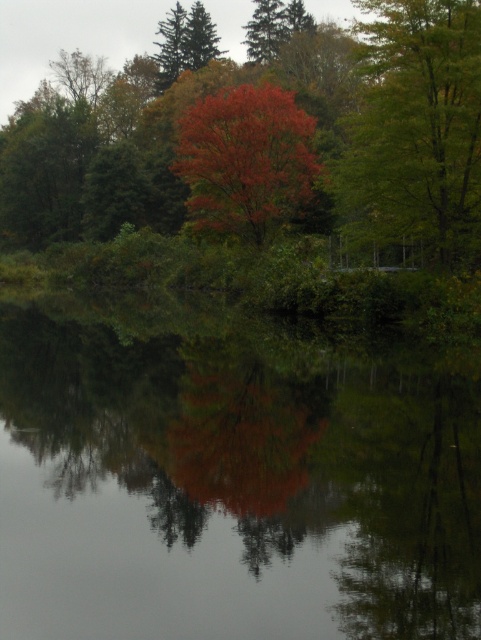
Who is more distant from viewer, (399, 156) or (230, 150)?

Positioned behind is point (230, 150).

Describe the element at coordinates (417, 125) in the screenshot. I see `green matte tree at upper right` at that location.

Find the location of a particular element. green matte tree at upper right is located at coordinates (417, 125).

Can you confirm if transparent water at center is smaller than shiny red leaves at center?

Indeed, transparent water at center has a smaller size compared to shiny red leaves at center.

Is point (39, 435) behind point (248, 124)?

That is False.

The width and height of the screenshot is (481, 640). Find the location of `transparent water at center`. transparent water at center is located at coordinates (230, 480).

Between vivid red leaves at center and green matte tree at upper right, which one has more height?

Standing taller between the two is vivid red leaves at center.

Between vivid red leaves at center and green matte tree at upper right, which one appears on the right side from the viewer's perspective?

green matte tree at upper right

Is point (433, 161) in front of point (405, 42)?

Yes, it is.

In order to click on vivid red leaves at center in this screenshot , I will do point(263,134).